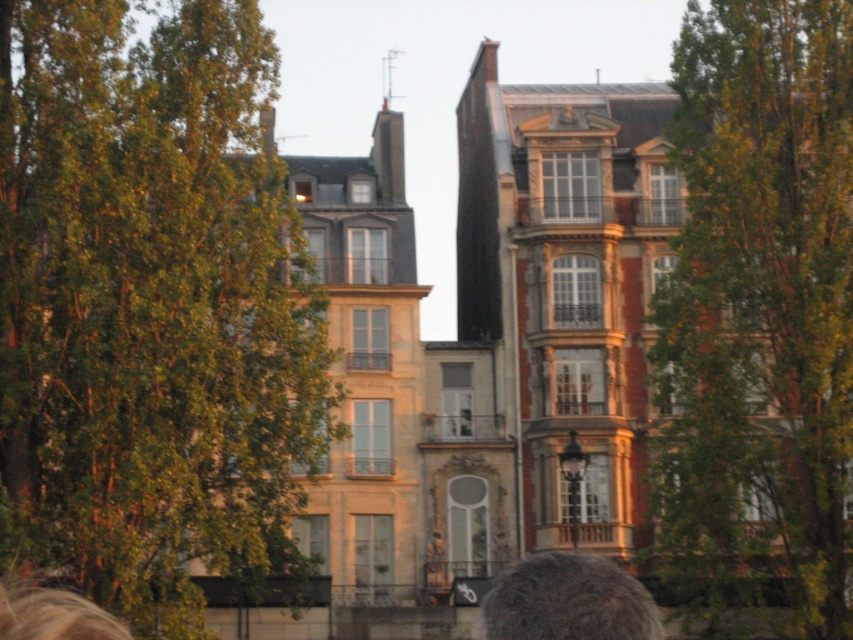
Does green leafy tree at left have a greater height compared to gray hair at lower center?

Yes, green leafy tree at left is taller than gray hair at lower center.

Between point (74, 449) and point (625, 616), which one is positioned in front?

Point (625, 616) is more forward.

Which is in front, point (109, 451) or point (643, 612)?

Point (643, 612) is more forward.

This screenshot has height=640, width=853. What are the coordinates of `green leafy tree at left` in the screenshot? It's located at (149, 307).

Between green leafy tree at left and green leafy tree at upper right, which one is positioned higher?

Positioned higher is green leafy tree at left.

Who is positioned more to the right, green leafy tree at left or green leafy tree at upper right?

green leafy tree at upper right is more to the right.

Where is `green leafy tree at left`? The width and height of the screenshot is (853, 640). green leafy tree at left is located at coordinates (149, 307).

Can you confirm if green leafy tree at upper right is positioned to the right of gray hair at lower center?

Yes, green leafy tree at upper right is to the right of gray hair at lower center.

Does green leafy tree at upper right appear over gray hair at lower center?

Yes, green leafy tree at upper right is above gray hair at lower center.

Is point (677, 92) closer to viewer compared to point (531, 628)?

No, it is behind (531, 628).

This screenshot has width=853, height=640. I want to click on green leafy tree at upper right, so (x=759, y=316).